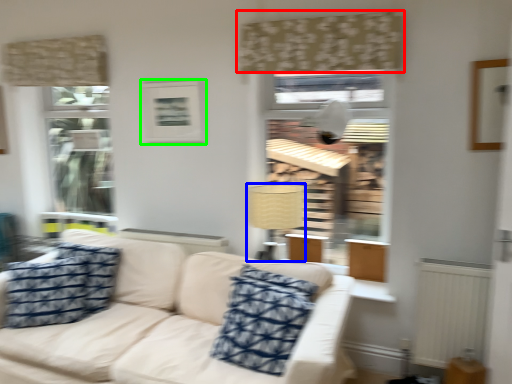
Question: Which is farther away from curtain (highlighted by a red box)? lamp (highlighted by a blue box) or picture frame (highlighted by a green box)?

Choices:
 (A) lamp
 (B) picture frame

Answer: (A)